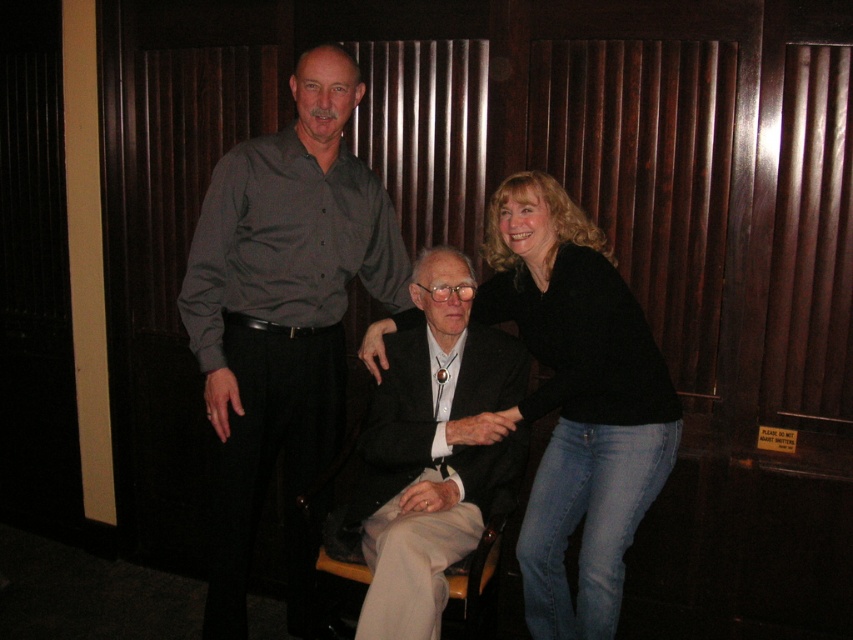
Question: Which of the following is the closest to the observer?

Choices:
 (A) (241, 440)
 (B) (428, 301)

Answer: (B)

Question: Which object is the farthest from the black shirt at upper center?

Choices:
 (A) matte gray shirt at upper left
 (B) black wool suit at center

Answer: (B)

Question: Which point is farther from the camera taking this photo?

Choices:
 (A) (334, 200)
 (B) (219, 332)

Answer: (A)

Question: Is black shirt at upper center above black wool suit at center?

Choices:
 (A) no
 (B) yes

Answer: (B)

Question: Is black shirt at upper center to the left of black wool suit at center from the viewer's perspective?

Choices:
 (A) no
 (B) yes

Answer: (B)

Question: Can you confirm if matte gray shirt at upper left is positioned to the right of black wool suit at center?

Choices:
 (A) yes
 (B) no

Answer: (B)